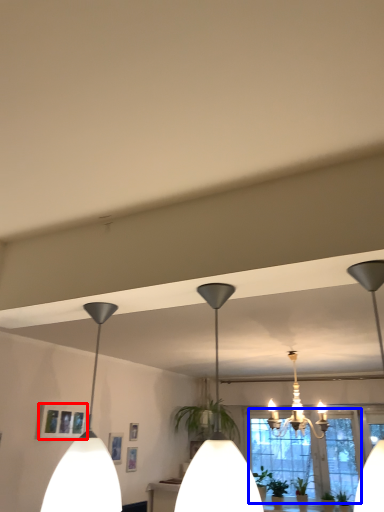
Question: Among these objects, which one is nearest to the camera, picture frame (highlighted by a red box) or window (highlighted by a blue box)?

Choices:
 (A) picture frame
 (B) window

Answer: (A)